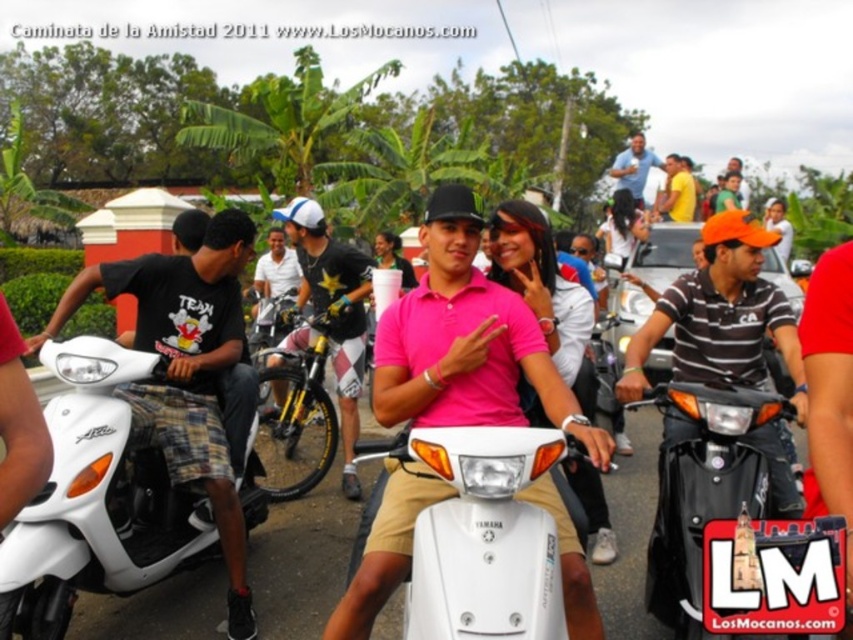
You are a photographer at the Caminata de la Amistad 2011 event. You want to capture a photo of the black glossy scooter at center and the yellow metallic bicycle at center in a way that both are visible. Given their positions, which one should you focus on first to ensure both are in frame?

The black glossy scooter at center is below the yellow metallic bicycle at center, so you should focus on the yellow metallic bicycle at center first to ensure both are in frame.

You are standing at the camera position and want to place a 2.5 meters long banner between you and the point at coordinates point (108,451). Will the banner fit without overlapping the point?

The point (108,451) is 3.11 meters away from the camera. Since the banner is 2.5 meters long, it will fit between you and the point without overlapping as there is enough space.

You are a photographer at the Caminata de la Amistad 2011 event. You want to take a photo of the two people at the center wearing the pink matte polo shirt at center and the striped cotton shirt at center. Which one is on the left side when facing the same direction as the photographer?

The pink matte polo shirt at center is positioned on the left side of the striped cotton shirt at center, so the person wearing the pink matte polo shirt at center is on the left when facing the same direction as the photographer.